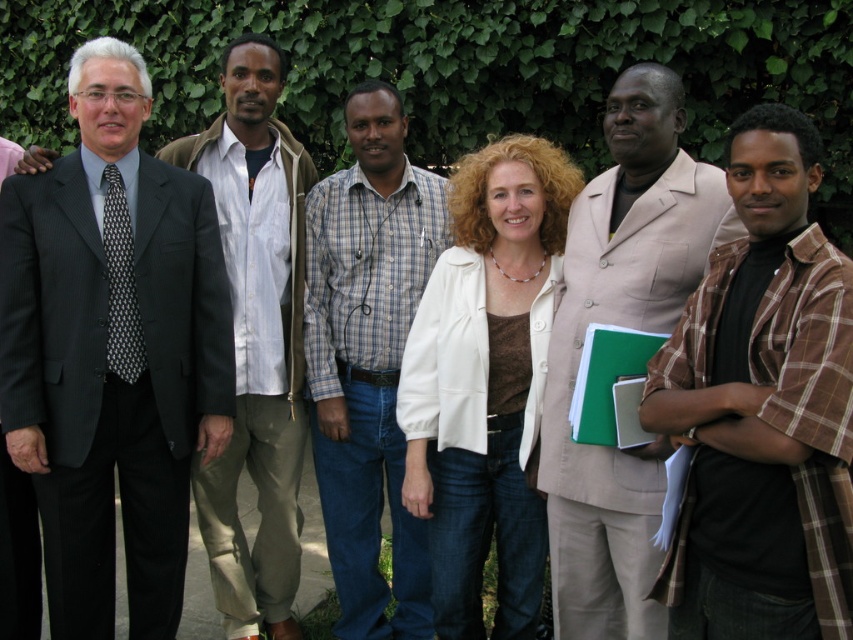
Consider the image. You are organizing a photo shoot and need to arrange the plaid shirt at center and white shirt at center so that both are visible in the frame. Which shirt should you place closer to the camera to ensure both are fully visible?

The plaid shirt at center is smaller than the white shirt at center. To ensure both are fully visible, you should place the plaid shirt at center closer to the camera since smaller objects need to be positioned nearer to maintain visibility in the frame.

You are a photographer taking a group photo of the plaid shirt at center and the white shirt at center. Which of the two shirts is closer to you?

The plaid shirt at center is closer to you because it is further to the viewer than the white shirt at center.